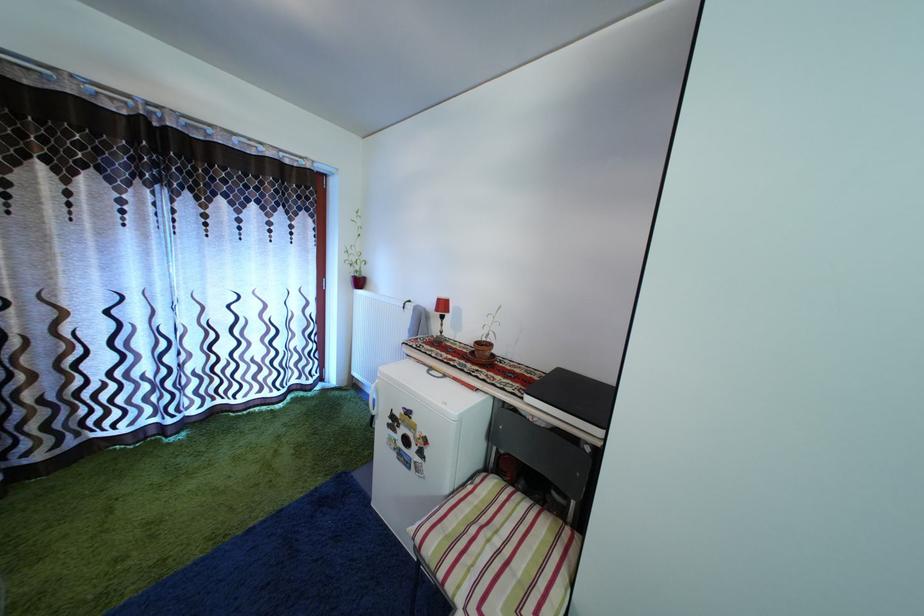
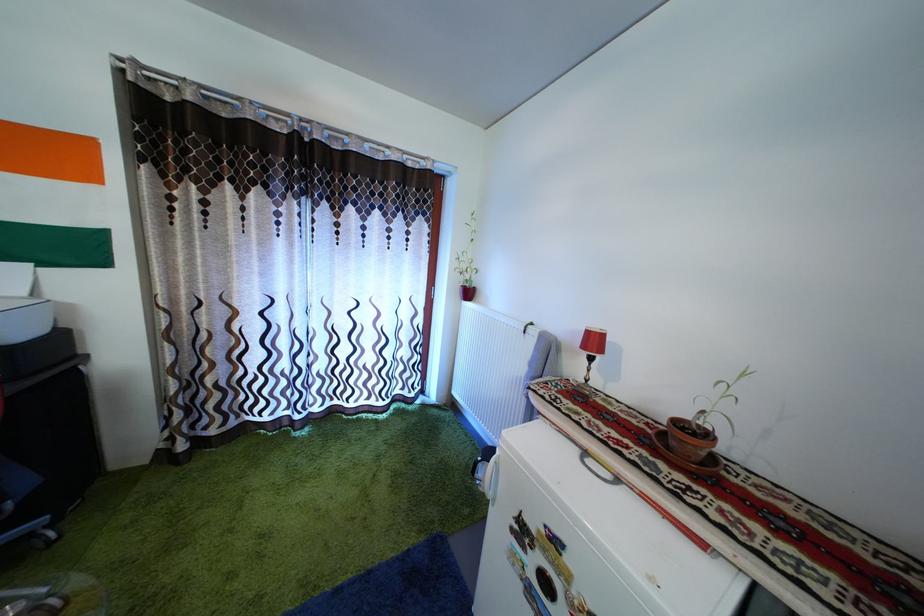
What movement of the cameraman would produce the second image?

The cameraman walked toward left, forward.